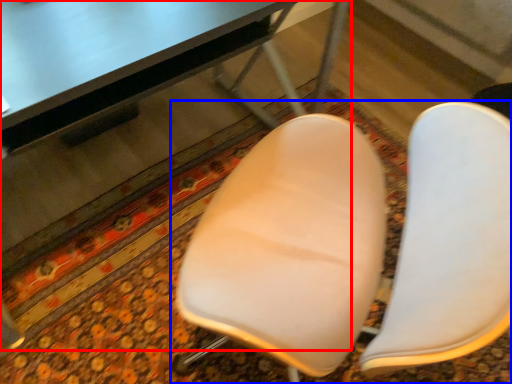
Question: Among these objects, which one is nearest to the camera, table (highlighted by a red box) or chair (highlighted by a blue box)?

Choices:
 (A) table
 (B) chair

Answer: (A)